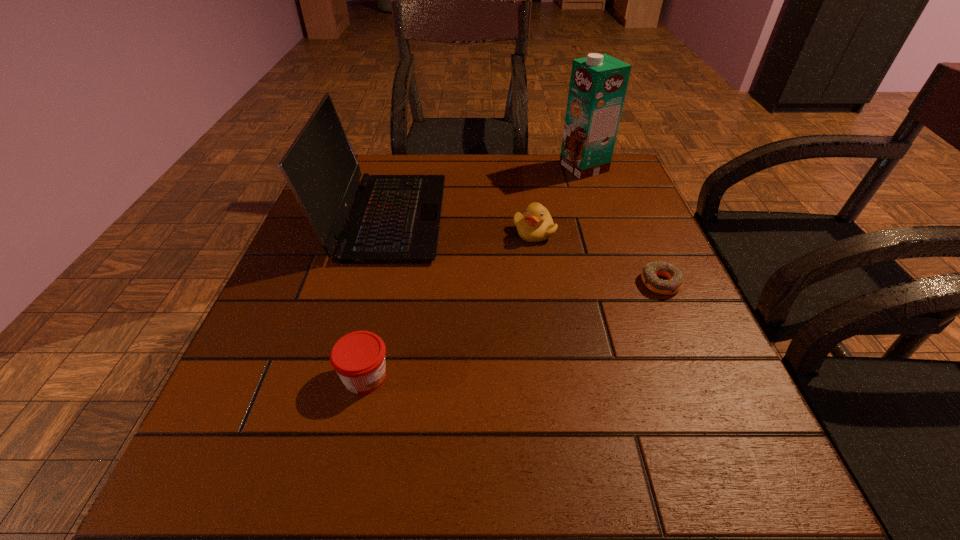
Find the location of a particular element. The image size is (960, 540). vacant space located 0.280m on the label side of the jam is located at coordinates (563, 376).

Where is `vacant space located on the back of the shortest object`? vacant space located on the back of the shortest object is located at coordinates (640, 234).

Locate an element on the screen. carton located at the far edge is located at coordinates (598, 83).

At what (x,y) coordinates should I click in order to perform the action: click on laptop computer that is positioned at the far edge. Please return your answer as a coordinate pair (x, y). The image size is (960, 540). Looking at the image, I should click on (394, 218).

At what (x,y) coordinates should I click in order to perform the action: click on object that is at the left edge. Please return your answer as a coordinate pair (x, y). Image resolution: width=960 pixels, height=540 pixels. Looking at the image, I should click on (394, 218).

I want to click on carton that is positioned at the right edge, so click(x=598, y=83).

Find the location of `doughnut present at the right edge`. doughnut present at the right edge is located at coordinates (650, 272).

Find the location of a particular element. object positioned at the far left corner is located at coordinates (394, 218).

What are the coordinates of `object that is at the far right corner` in the screenshot? It's located at pos(598,83).

In the image, there is a desktop. At what (x,y) coordinates should I click in order to perform the action: click on free region at the far edge. Please return your answer as a coordinate pair (x, y). Looking at the image, I should click on (420, 174).